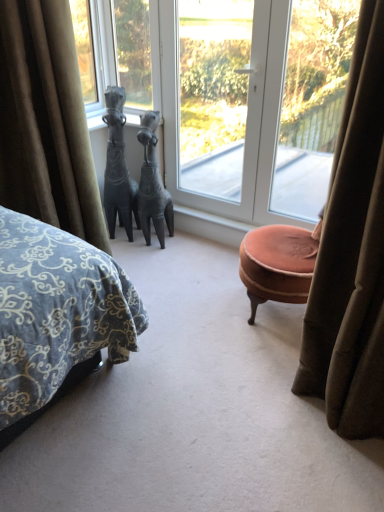
Question: In the image, is transparent glass window at upper center, marked as the first window in a left-to-right arrangement, positioned in front of or behind black stone horse at center?

Choices:
 (A) behind
 (B) front

Answer: (A)

Question: Considering the relative positions of transparent glass window at upper center, marked as the first window in a left-to-right arrangement, and black stone horse at center in the image provided, is transparent glass window at upper center, marked as the first window in a left-to-right arrangement, to the left or to the right of black stone horse at center?

Choices:
 (A) left
 (B) right

Answer: (B)

Question: Which object is positioned farthest from the transparent glass door at center?

Choices:
 (A) velvet brown curtain at left
 (B) transparent glass window at upper right, marked as the 1th window in a right-to-left arrangement
 (C) bronze horse at center
 (D) transparent glass window at upper center, marked as the first window in a left-to-right arrangement
 (E) transparent glass door at center, the second window positioned from the right

Answer: (A)

Question: Estimate the real-world distances between objects in this image. Which object is farther from the transparent glass door at center, marked as the 2th window in a left-to-right arrangement?

Choices:
 (A) velvet brown curtain at left
 (B) transparent glass window at upper right, the 3th window positioned from the left
 (C) transparent glass window at upper center, marked as the first window in a left-to-right arrangement
 (D) black stone horse at center
 (E) bronze horse at center

Answer: (A)